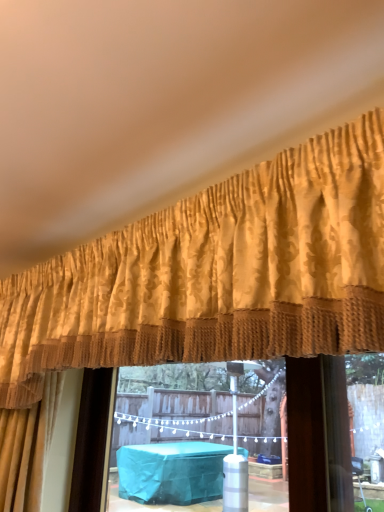
Question: From a real-world perspective, is gold damask curtain at upper center under brown textured curtain at center?

Choices:
 (A) yes
 (B) no

Answer: (B)

Question: Are gold damask curtain at upper center and brown textured curtain at center beside each other?

Choices:
 (A) yes
 (B) no

Answer: (B)

Question: Is brown textured curtain at center surrounded by gold damask curtain at upper center?

Choices:
 (A) no
 (B) yes

Answer: (A)

Question: From a real-world perspective, does gold damask curtain at upper center stand above brown textured curtain at center?

Choices:
 (A) no
 (B) yes

Answer: (B)

Question: Is gold damask curtain at upper center outside brown textured curtain at center?

Choices:
 (A) no
 (B) yes

Answer: (B)

Question: Could you tell me if gold damask curtain at upper center is turned towards brown textured curtain at center?

Choices:
 (A) yes
 (B) no

Answer: (B)

Question: Is brown textured curtain at center behind gold damask curtain at upper center?

Choices:
 (A) no
 (B) yes

Answer: (B)

Question: Is brown textured curtain at center outside of gold damask curtain at upper center?

Choices:
 (A) no
 (B) yes

Answer: (B)

Question: Is brown textured curtain at center looking in the opposite direction of gold damask curtain at upper center?

Choices:
 (A) yes
 (B) no

Answer: (B)

Question: Considering the relative sizes of brown textured curtain at center and gold damask curtain at upper center in the image provided, is brown textured curtain at center shorter than gold damask curtain at upper center?

Choices:
 (A) no
 (B) yes

Answer: (A)

Question: Considering the relative sizes of brown textured curtain at center and gold damask curtain at upper center in the image provided, is brown textured curtain at center bigger than gold damask curtain at upper center?

Choices:
 (A) yes
 (B) no

Answer: (B)

Question: Is there a large distance between brown textured curtain at center and gold damask curtain at upper center?

Choices:
 (A) yes
 (B) no

Answer: (B)

Question: Considering the positions of brown textured curtain at center and gold damask curtain at upper center in the image, is brown textured curtain at center taller or shorter than gold damask curtain at upper center?

Choices:
 (A) tall
 (B) short

Answer: (A)